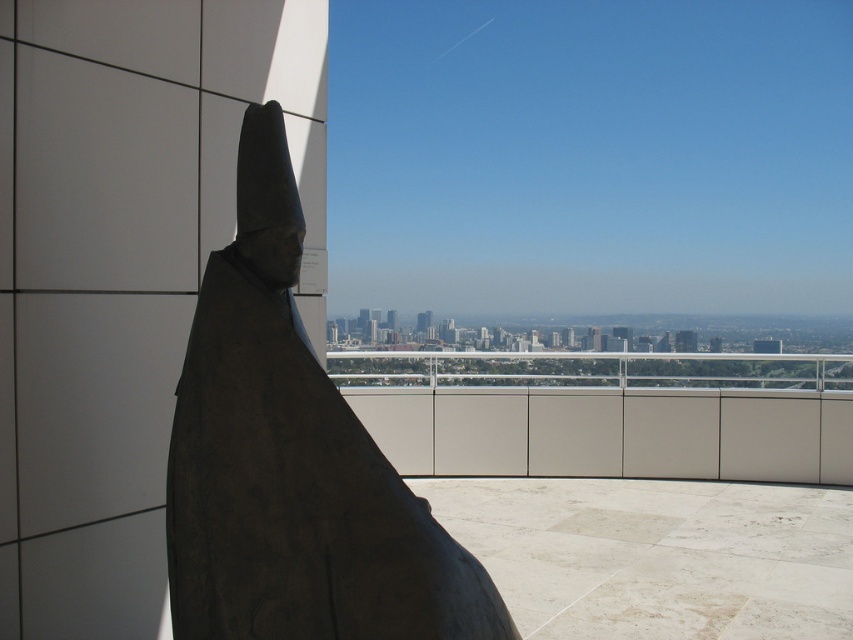
You are an architect designing a new outdoor exhibition space. You need to place the dark gray stone statue at left and the smooth concrete balcony at center such that they are aligned along the same axis. Given their spatial dimensions, which object should be positioned closer to the entrance for optimal visibility?

The dark gray stone statue at left is thinner than the smooth concrete balcony at center, so positioning the statue closer to the entrance would allow visitors to see it more clearly before encountering the wider balcony.